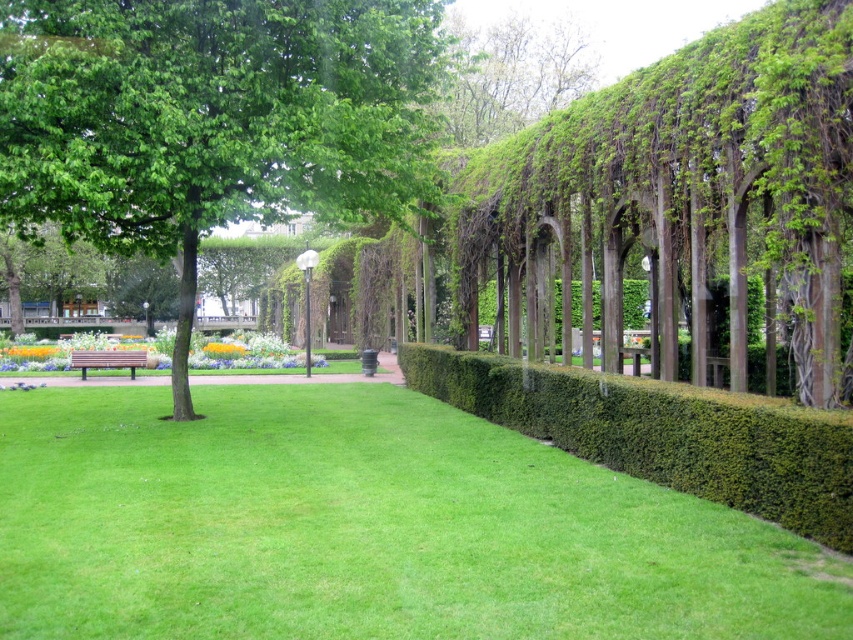
You are planning to install a new bird feeder in the park. The bird feeder requires a mounting height of at least 1.5 meters to keep it safe from ground predators. Based on the scene, which object between the green dense hedge at right and the brown wooden bench at lower left would be suitable for mounting the bird feeder?

The green dense hedge at right is taller than the brown wooden bench at lower left, so the bird feeder should be mounted on the green dense hedge at right as it meets the required height of 1.5 meters.

You are planning to place a new bench in the park. The current brown wooden bench at lower left is narrower than the green dense hedge at right. Which object should you consider for placement if you need more space?

The green dense hedge at right is wider than the brown wooden bench at lower left, so placing the new bench near the green dense hedge at right would provide more space.

You are planning to lay a new pathway in the park. The pathway will be placed between the green grassy at center and the green dense hedge at right. If the pathway needs to be 2 meters wide, can it fit between them without overlapping either?

The green grassy at center is wider than the green dense hedge at right. Since the grassy area is wider, there is enough space to place a 2 meter wide pathway between them without overlapping either.